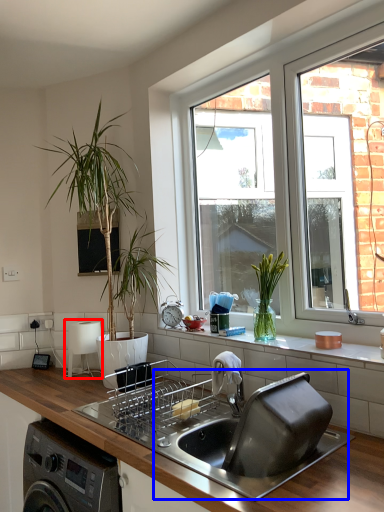
Question: Which object appears farthest to the camera in this image, appliance (highlighted by a red box) or sink (highlighted by a blue box)?

Choices:
 (A) appliance
 (B) sink

Answer: (A)